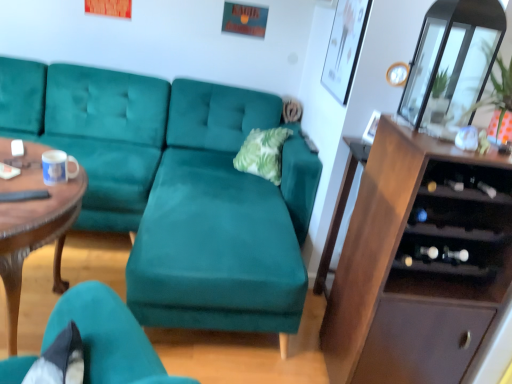
I want to click on free space above brown wood cabinet at right (from a real-world perspective), so click(454, 140).